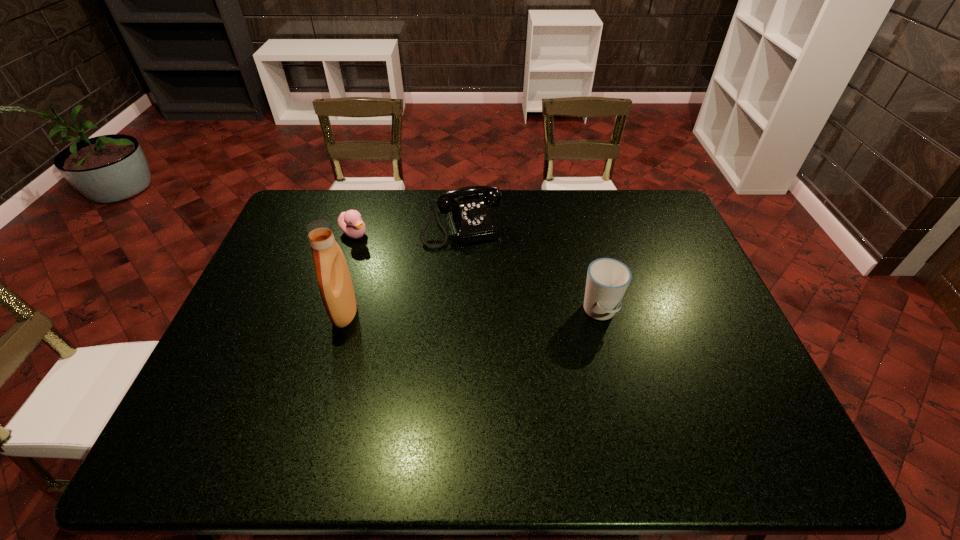
Locate an element on the screen. vacant space at the far left corner is located at coordinates (321, 194).

Where is `vacant region between the detergent and the cup`? vacant region between the detergent and the cup is located at coordinates (472, 312).

Find the location of a particular element. This screenshot has height=540, width=960. vacant area between the cup and the detergent is located at coordinates (472, 312).

I want to click on vacant point located between the duckling and the cup, so click(477, 273).

Where is `free space between the cup and the detergent`? Image resolution: width=960 pixels, height=540 pixels. free space between the cup and the detergent is located at coordinates (472, 312).

Identify the location of free space between the detergent and the telephone. This screenshot has width=960, height=540. (403, 268).

This screenshot has height=540, width=960. In order to click on unoccupied area between the rightmost object and the tallest object in this screenshot , I will do `click(472, 312)`.

The width and height of the screenshot is (960, 540). I want to click on vacant region between the second object from right to left and the shortest object, so click(x=408, y=230).

Where is `unoccupied position between the third object from left to right and the duckling`? This screenshot has width=960, height=540. unoccupied position between the third object from left to right and the duckling is located at coordinates (408, 230).

Locate an element on the screen. The width and height of the screenshot is (960, 540). free space that is in between the detergent and the rightmost object is located at coordinates (472, 312).